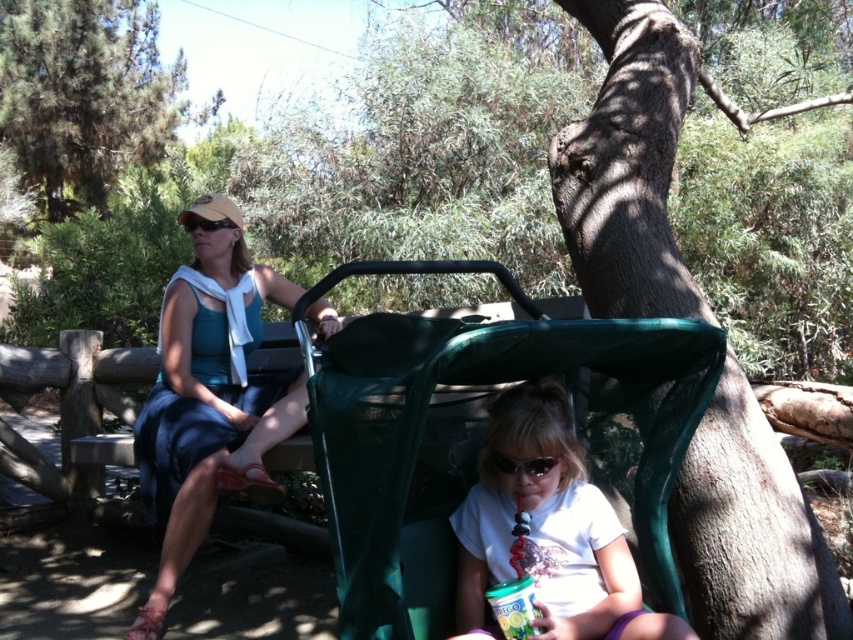
Can you confirm if green mesh stroller at center is smaller than white matte shirt at center?

Actually, green mesh stroller at center might be larger than white matte shirt at center.

How distant is green mesh stroller at center from white matte shirt at center?

7.68 inches

Is point (641, 388) behind point (596, 636)?

Yes, it is behind point (596, 636).

Find the location of a particular element. The height and width of the screenshot is (640, 853). green mesh stroller at center is located at coordinates (474, 435).

Which is in front, point (584, 589) or point (140, 83)?

Point (584, 589)

Which is in front, point (560, 609) or point (32, 67)?

Positioned in front is point (560, 609).

The width and height of the screenshot is (853, 640). In order to click on white matte shirt at center in this screenshot , I will do `click(549, 531)`.

Describe the element at coordinates (209, 396) in the screenshot. I see `matte blue dress at center` at that location.

Is point (138, 454) positioned after point (502, 573)?

Yes, point (138, 454) is behind point (502, 573).

Find the location of a particular element. matte blue dress at center is located at coordinates (209, 396).